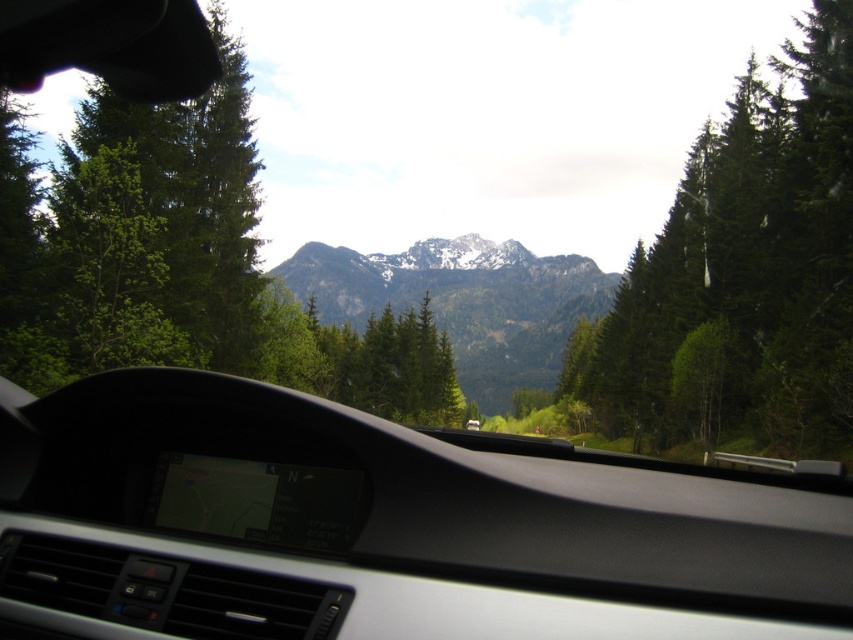
The height and width of the screenshot is (640, 853). Describe the element at coordinates (381, 528) in the screenshot. I see `transparent glass windshield at center` at that location.

Based on the photo, how distant is transparent glass windshield at center from green matte tree at left?

A distance of 25.89 feet exists between transparent glass windshield at center and green matte tree at left.

Does point (619, 541) come in front of point (155, 266)?

Yes, point (619, 541) is in front of point (155, 266).

Image resolution: width=853 pixels, height=640 pixels. What are the coordinates of `transparent glass windshield at center` in the screenshot? It's located at (381, 528).

Who is shorter, green textured tree at right or green matte tree at left?

Standing shorter between the two is green matte tree at left.

How far apart are green textured tree at right and green matte tree at left?

green textured tree at right is 34.73 meters away from green matte tree at left.

Is point (843, 316) positioned before point (215, 300)?

That is True.

Find the location of a particular element. Image resolution: width=853 pixels, height=640 pixels. green textured tree at right is located at coordinates (743, 275).

Is point (409, 570) positioned behind point (828, 392)?

No, (409, 570) is closer to viewer.

Is point (437, 509) positioned before point (805, 51)?

That is True.

This screenshot has height=640, width=853. I want to click on transparent glass windshield at center, so click(x=381, y=528).